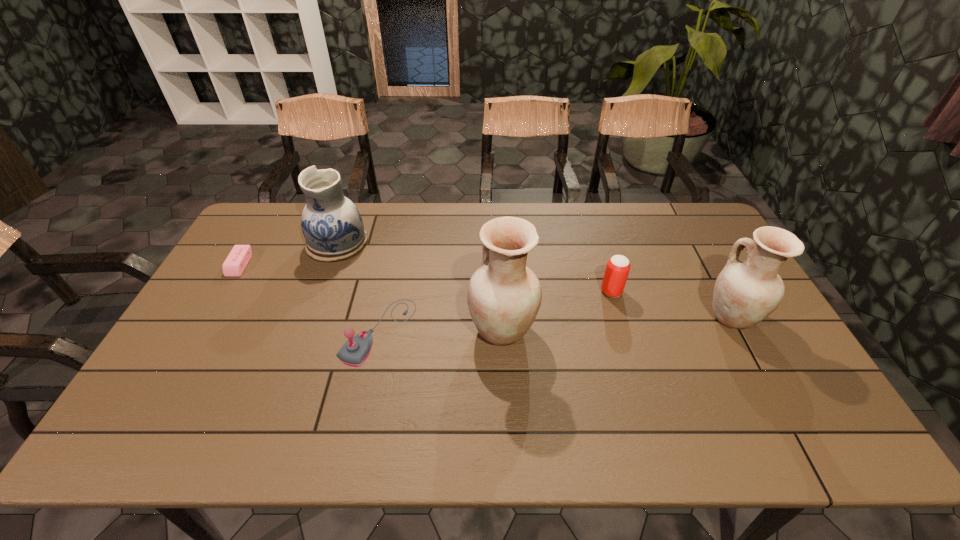
Identify the location of the tallest pottery. (504, 296).

Find the location of a particular element. The width and height of the screenshot is (960, 540). the tallest object is located at coordinates (504, 296).

Where is `the rightmost object`? the rightmost object is located at coordinates (746, 292).

The width and height of the screenshot is (960, 540). Identify the location of the farthest pottery. (332, 225).

Locate an element on the screen. This screenshot has height=540, width=960. the fifth object from right to left is located at coordinates (332, 225).

I want to click on the shortest object, so click(234, 265).

The image size is (960, 540). Identify the location of the leftmost object. (234, 265).

At what (x,y) coordinates should I click in order to perform the action: click on beer can. Please return your answer as a coordinate pair (x, y). Looking at the image, I should click on (616, 273).

Find the location of `the third shortest object`. the third shortest object is located at coordinates (616, 273).

Where is `the fourth object from right to left`? Image resolution: width=960 pixels, height=540 pixels. the fourth object from right to left is located at coordinates (354, 352).